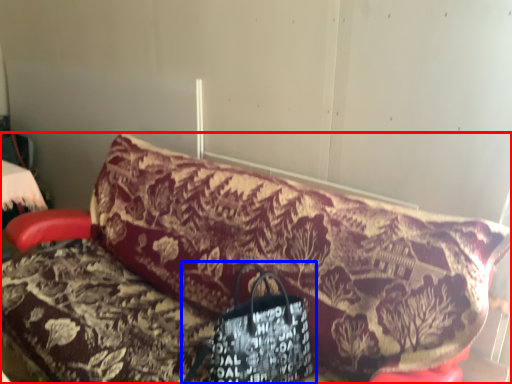
Question: Among these objects, which one is farthest to the camera, furniture (highlighted by a red box) or handbag (highlighted by a blue box)?

Choices:
 (A) furniture
 (B) handbag

Answer: (B)